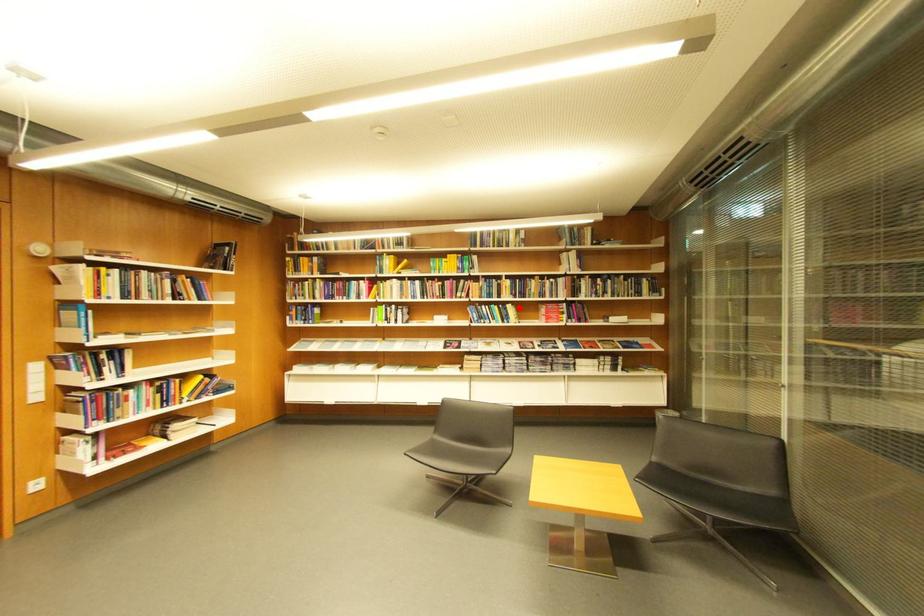
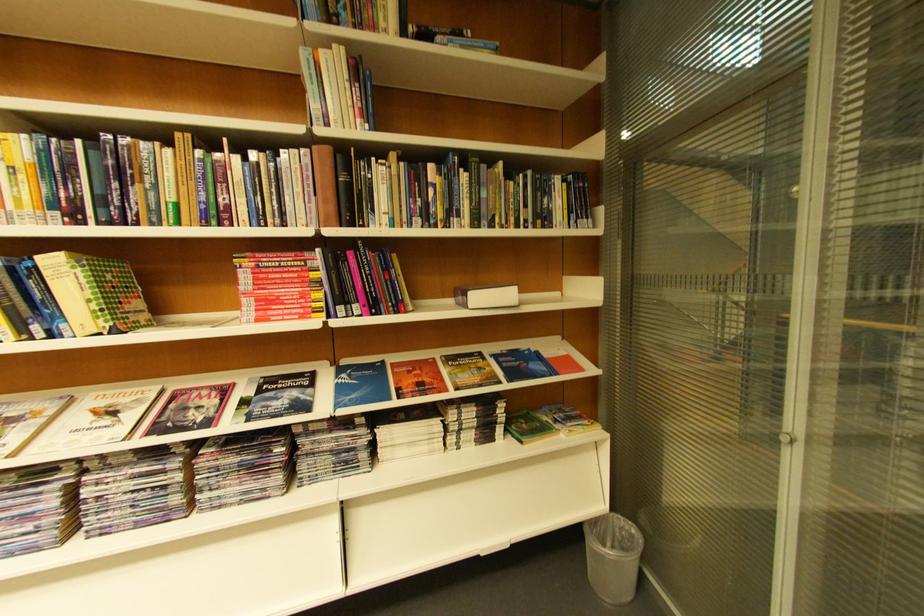
The point at the highlighted location is marked in the first image. Where is the corresponding point in the second image?

(63, 264)